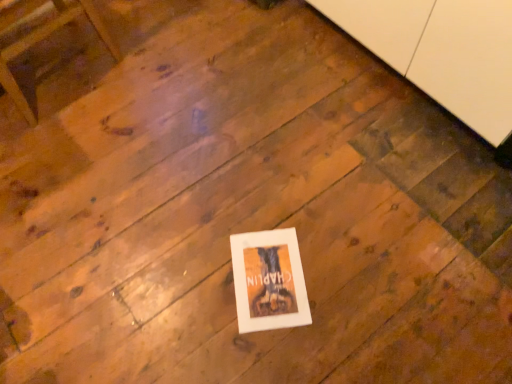
The width and height of the screenshot is (512, 384). In order to click on vacant location below white paper at center (from a real-world perspective) in this screenshot , I will do `click(266, 275)`.